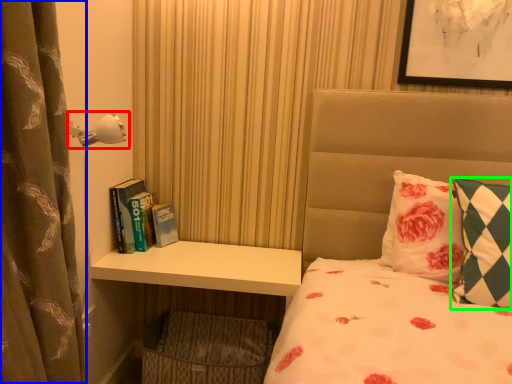
Question: Which object is the farthest from lamp (highlighted by a red box)? Choose among these: curtain (highlighted by a blue box) or pillow (highlighted by a green box).

Choices:
 (A) curtain
 (B) pillow

Answer: (B)